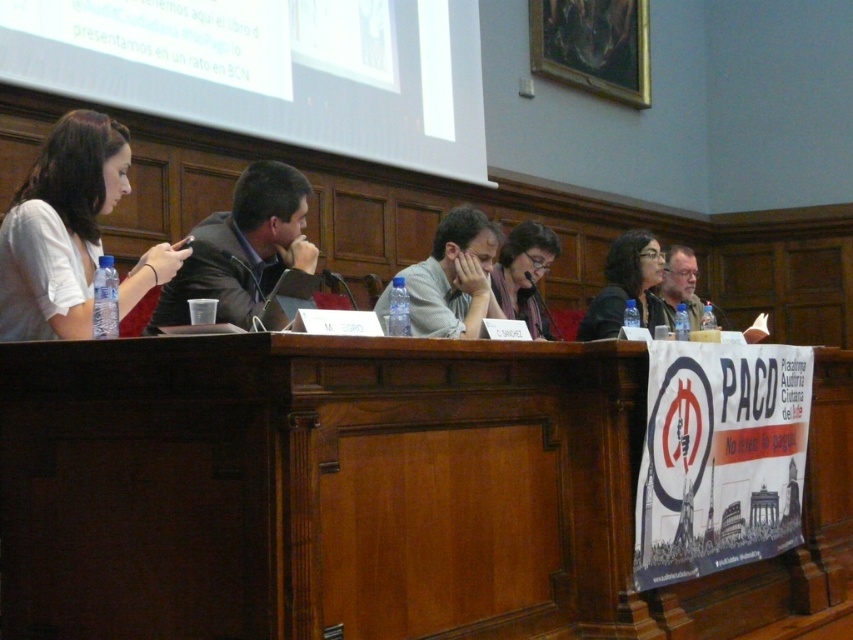
You are attending a meeting in a room with a large projection screen showing Spanish text. You need to place a document on the brown wood table at center. Where exactly should you place it to ensure it is at the coordinate point specified as point (366, 492)?

The point (366, 492) corresponds to the brown wood table at center, so placing the document there will ensure it is at the correct coordinate.

You are a participant in the meeting and want to place a 2.5 feet wide laptop on the brown wood table at center. Can you fit it on the table?

The brown wood table at center and viewer are 6.94 feet apart from each other. This distance does not provide information about the table size. Therefore, it is impossible to determine if the laptop will fit.